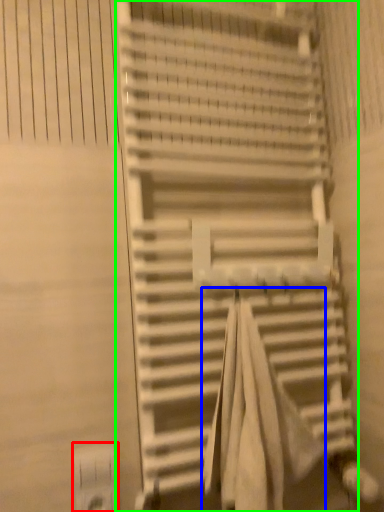
Question: Considering the real-world distances, which object is farthest from electric outlet (highlighted by a red box)? beach towel (highlighted by a blue box) or stairs (highlighted by a green box)?

Choices:
 (A) beach towel
 (B) stairs

Answer: (B)